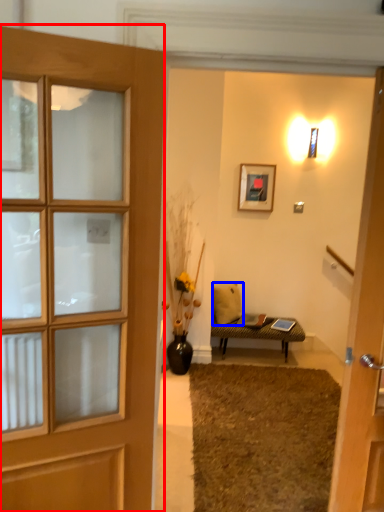
Question: Which object appears farthest to the camera in this image, door (highlighted by a red box) or pillow (highlighted by a blue box)?

Choices:
 (A) door
 (B) pillow

Answer: (B)